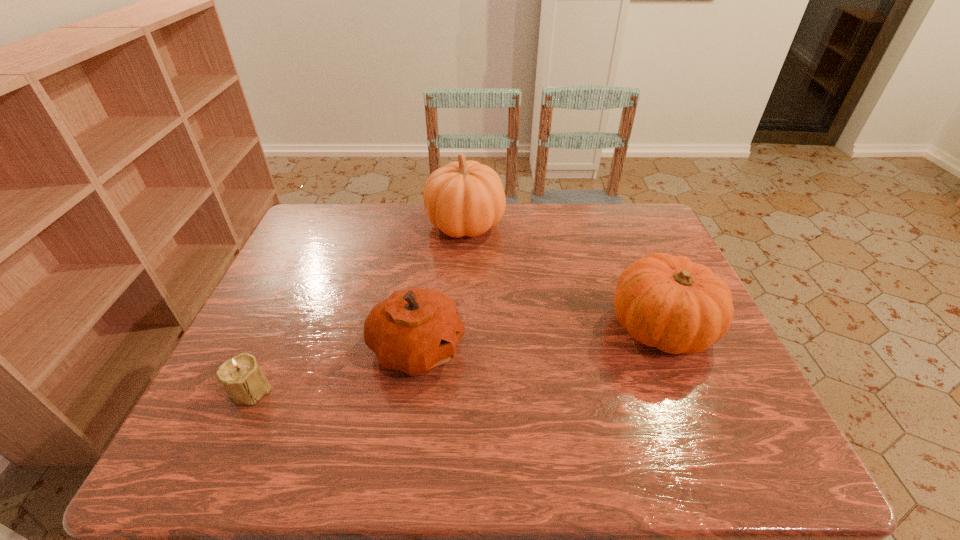
What are the coordinates of `the closest object to the candle_holder` in the screenshot? It's located at (415, 330).

Find the location of a particular element. The width and height of the screenshot is (960, 540). object that is the closest to the rightmost object is located at coordinates (464, 198).

Point out which pumpkin is positioned as the third nearest to the candle_holder. Please provide its 2D coordinates. Your answer should be formatted as a tuple, i.e. [(x, y)], where the tuple contains the x and y coordinates of a point satisfying the conditions above.

[(663, 301)]

You are a GUI agent. You are given a task and a screenshot of the screen. Output one action in this format:
    pyautogui.click(x=<x>, y=<y>)
    Task: Click on the pumpkin that is the closest to the leftmost object
    
    Given the screenshot: What is the action you would take?
    [415, 330]